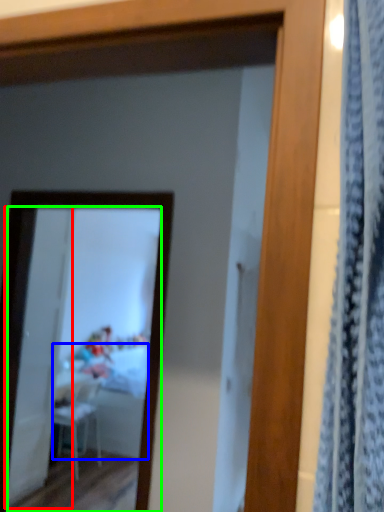
Question: Which is nearer to the screen door (highlighted by a red box)? table (highlighted by a blue box) or mirror (highlighted by a green box).

Choices:
 (A) table
 (B) mirror

Answer: (B)